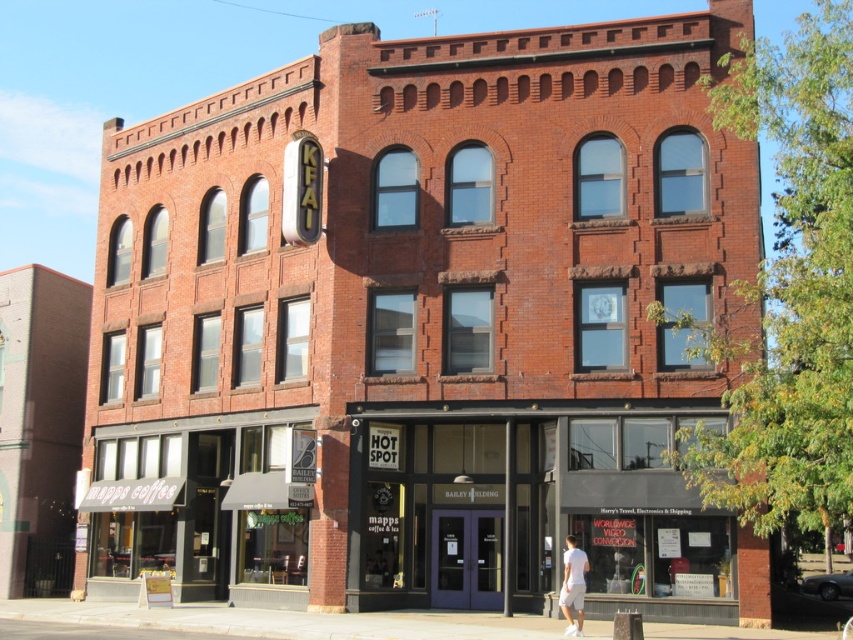
You are a delivery person who needs to deliver a package to the matte black storefront at center and the white cotton shorts at lower right. Which location requires a larger delivery vehicle?

The matte black storefront at center is bigger than the white cotton shorts at lower right, so the delivery vehicle for the matte black storefront at center should be larger.

You are a delivery person standing in front of the building and need to deliver a package to the matte black storefront at center and the white cotton shorts at lower right. The delivery truck can only park once. Which storefront should you park closer to first to minimize the walking distance?

Result: The matte black storefront at center is 6.08 meters away from the white cotton shorts at lower right. To minimize walking distance, park closer to either one first since the distance between them is fixed. However, if you park at the midpoint, you can reduce total walking distance. But since parking is only once, park closer to whichever is more frequently visited or as per delivery instructions.

You are standing in front of the three story brick building and want to enter the matte black storefront at center. Which direction should you walk relative to the white cotton shorts at lower right to reach it?

You should walk towards the matte black storefront at center, which is closer to you than the white cotton shorts at lower right, so move toward it directly without needing to go around the white cotton shorts at lower right.